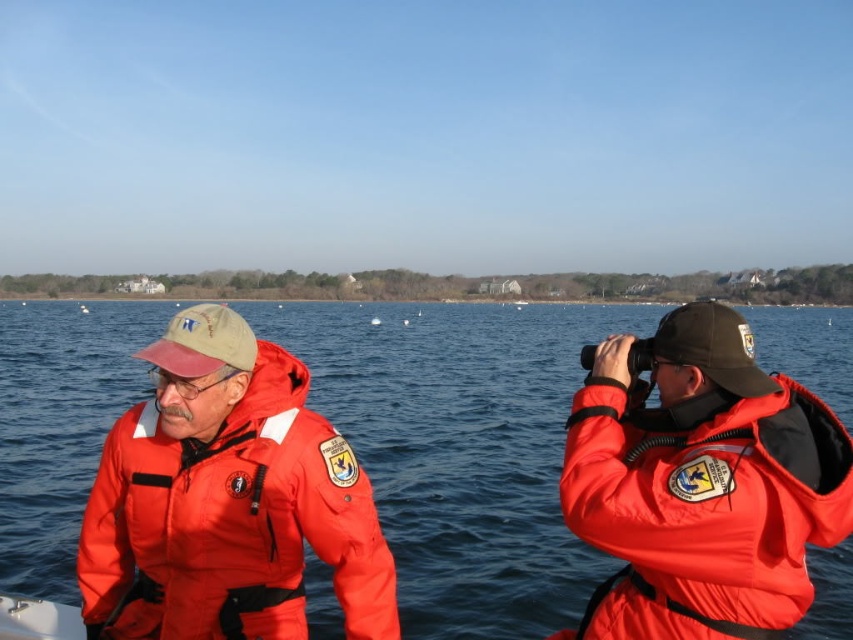
Question: Among these points, which one is farthest from the camera?

Choices:
 (A) (505, 632)
 (B) (172, 477)
 (C) (679, 504)

Answer: (A)

Question: Which of these objects is positioned farthest from the matte orange life jacket at left?

Choices:
 (A) matte orange life jacket at right
 (B) blue water at center

Answer: (B)

Question: In this image, where is blue water at center located relative to matte orange life jacket at left?

Choices:
 (A) right
 (B) left

Answer: (A)

Question: Observing the image, what is the correct spatial positioning of matte orange life jacket at left in reference to matte orange life jacket at right?

Choices:
 (A) left
 (B) right

Answer: (A)

Question: Can you confirm if blue water at center is positioned above matte orange life jacket at left?

Choices:
 (A) yes
 (B) no

Answer: (A)

Question: Considering the real-world distances, which object is closest to the matte orange life jacket at left?

Choices:
 (A) blue water at center
 (B) matte orange life jacket at right

Answer: (B)